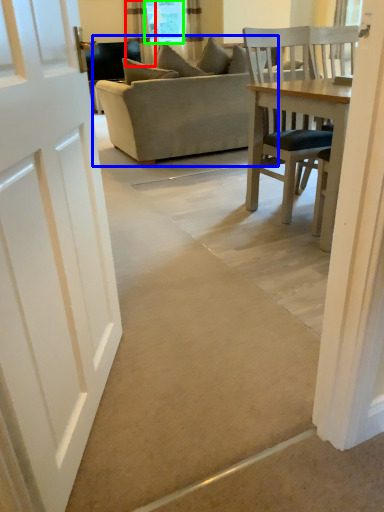
Question: Which is farther away from curtain (highlighted by a red box)? studio couch (highlighted by a blue box) or window screen (highlighted by a green box)?

Choices:
 (A) studio couch
 (B) window screen

Answer: (A)